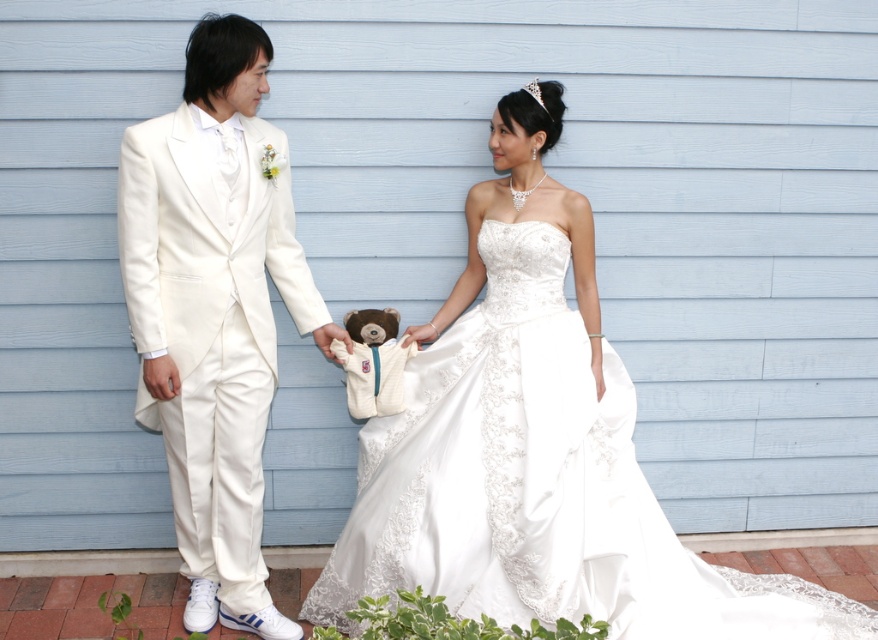
Question: Can you confirm if satin/embroidered dress at center is wider than white satin suit at left?

Choices:
 (A) yes
 (B) no

Answer: (A)

Question: Does satin/embroidered dress at center appear on the right side of white satin suit at left?

Choices:
 (A) no
 (B) yes

Answer: (B)

Question: Can you confirm if satin/embroidered dress at center is smaller than white satin suit at left?

Choices:
 (A) yes
 (B) no

Answer: (B)

Question: Among these objects, which one is nearest to the camera?

Choices:
 (A) white satin suit at left
 (B) satin/embroidered dress at center

Answer: (B)